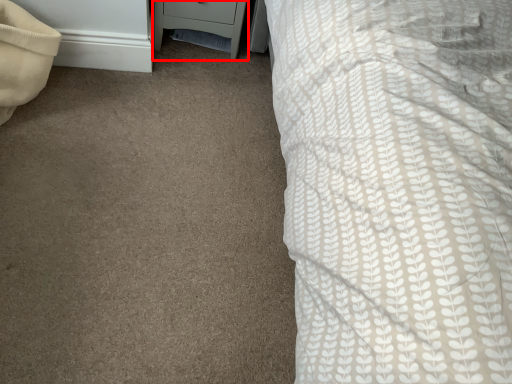
Question: From the image's perspective, where is nightstand (annotated by the red box) located in relation to pillow in the image?

Choices:
 (A) below
 (B) above

Answer: (B)